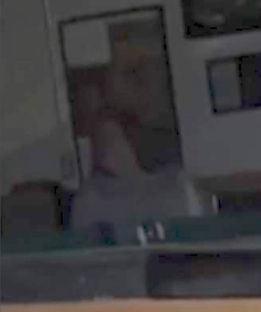
Where is `table`? Image resolution: width=261 pixels, height=312 pixels. table is located at coordinates (128, 254).